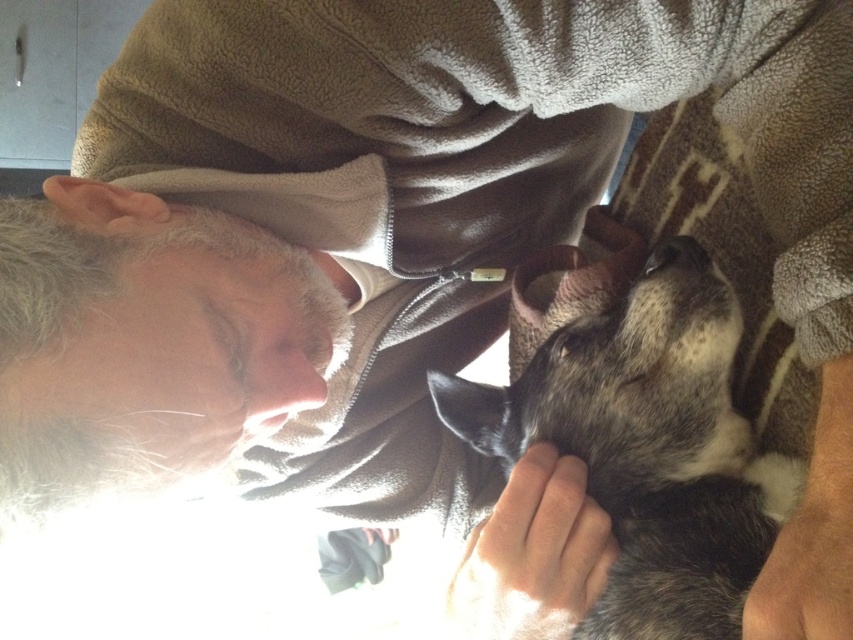
Question: Which object is farther from the camera taking this photo?

Choices:
 (A) smooth skin nose at center
 (B) speckled fur dog at center

Answer: (A)

Question: Which point is closer to the camera taking this photo?

Choices:
 (A) (252, 385)
 (B) (688, 513)

Answer: (B)

Question: Does speckled fur dog at center have a larger size compared to smooth skin nose at center?

Choices:
 (A) yes
 (B) no

Answer: (A)

Question: Can you confirm if speckled fur dog at center is positioned to the right of smooth skin nose at center?

Choices:
 (A) yes
 (B) no

Answer: (A)

Question: Which of the following is the farthest from the observer?

Choices:
 (A) (277, 422)
 (B) (505, 410)

Answer: (B)

Question: Does speckled fur dog at center appear under smooth skin nose at center?

Choices:
 (A) no
 (B) yes

Answer: (B)